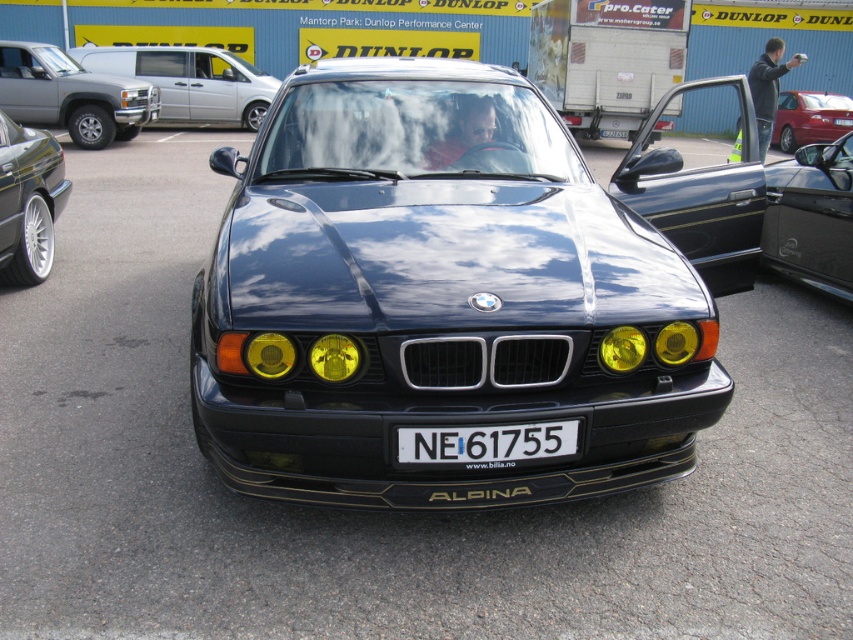
Question: Which object appears farthest from the camera in this image?

Choices:
 (A) white plastic license plate at center
 (B) glossy black door at right

Answer: (B)

Question: Is white plastic license plate at center below metallic red sedan at right?

Choices:
 (A) yes
 (B) no

Answer: (A)

Question: Which of these objects is positioned farthest from the silver metallic suv at upper left?

Choices:
 (A) metallic red sedan at right
 (B) glossy black car at center

Answer: (A)

Question: Is glossy black door at right to the left of silver metallic van at upper left from the viewer's perspective?

Choices:
 (A) yes
 (B) no

Answer: (B)

Question: Is glossy black door at right wider than yellow matte headlight at center?

Choices:
 (A) no
 (B) yes

Answer: (B)

Question: Which object appears closest to the camera in this image?

Choices:
 (A) glossy black car at center
 (B) silver metallic suv at upper left

Answer: (A)